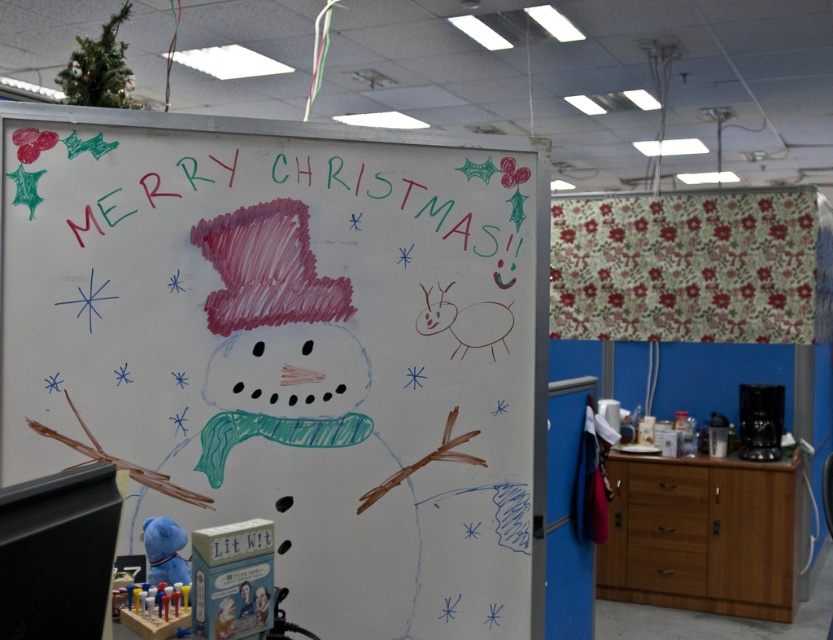
Question: Which of the following is the farthest from the observer?

Choices:
 (A) colored chalk snowman at center
 (B) blue plush toy at lower left
 (C) white chalkboard at center

Answer: (A)

Question: Which is nearer to the blue plush toy at lower left?

Choices:
 (A) colored chalk snowman at center
 (B) white chalkboard at center

Answer: (A)

Question: From the image, what is the correct spatial relationship of white chalkboard at center in relation to blue plush toy at lower left?

Choices:
 (A) below
 (B) above

Answer: (B)

Question: Observing the image, what is the correct spatial positioning of white chalkboard at center in reference to colored chalk snowman at center?

Choices:
 (A) left
 (B) right

Answer: (B)

Question: Does white chalkboard at center appear over blue plush toy at lower left?

Choices:
 (A) no
 (B) yes

Answer: (B)

Question: Which of the following is the closest to the observer?

Choices:
 (A) (148, 556)
 (B) (476, 150)

Answer: (A)